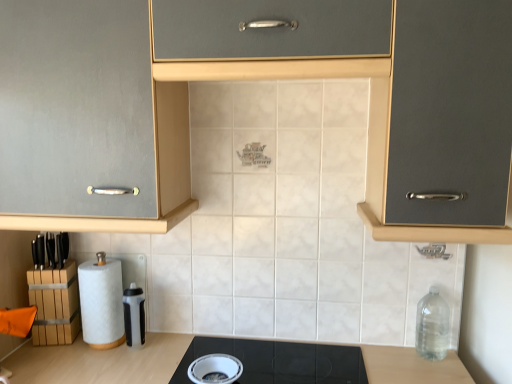
Question: Is translucent plastic water bottle at lower center, which appears as the 1th appliance when viewed from the back, smaller than clear plastic bottle at right?

Choices:
 (A) yes
 (B) no

Answer: (A)

Question: Considering the relative positions of translucent plastic water bottle at lower center, the first appliance when ordered from left to right, and clear plastic bottle at right in the image provided, is translucent plastic water bottle at lower center, the first appliance when ordered from left to right, in front of clear plastic bottle at right?

Choices:
 (A) yes
 (B) no

Answer: (B)

Question: From the image's perspective, is translucent plastic water bottle at lower center, acting as the second appliance starting from the front, located beneath clear plastic bottle at right?

Choices:
 (A) yes
 (B) no

Answer: (A)

Question: Is translucent plastic water bottle at lower center, placed as the first appliance when sorted from top to bottom, facing towards clear plastic bottle at right?

Choices:
 (A) no
 (B) yes

Answer: (A)

Question: Considering the relative sizes of translucent plastic water bottle at lower center, which appears as the 1th appliance when viewed from the back, and clear plastic bottle at right in the image provided, is translucent plastic water bottle at lower center, which appears as the 1th appliance when viewed from the back, shorter than clear plastic bottle at right?

Choices:
 (A) no
 (B) yes

Answer: (B)

Question: Is there a large distance between translucent plastic water bottle at lower center, the second appliance from the bottom, and clear plastic bottle at right?

Choices:
 (A) yes
 (B) no

Answer: (A)

Question: Is white matte paper towel at lower left far away from matte gray cabinet at center?

Choices:
 (A) no
 (B) yes

Answer: (A)

Question: Does white matte paper towel at lower left have a lesser width compared to matte gray cabinet at center?

Choices:
 (A) yes
 (B) no

Answer: (A)

Question: Does white matte paper towel at lower left come in front of matte gray cabinet at center?

Choices:
 (A) yes
 (B) no

Answer: (B)

Question: Does white matte paper towel at lower left come behind matte gray cabinet at center?

Choices:
 (A) yes
 (B) no

Answer: (A)

Question: Can you confirm if white matte paper towel at lower left is bigger than matte gray cabinet at center?

Choices:
 (A) no
 (B) yes

Answer: (A)

Question: Is white matte paper towel at lower left outside of matte gray cabinet at center?

Choices:
 (A) no
 (B) yes

Answer: (B)

Question: Does black glass cooktop at center come in front of matte gray cabinet at center?

Choices:
 (A) no
 (B) yes

Answer: (A)